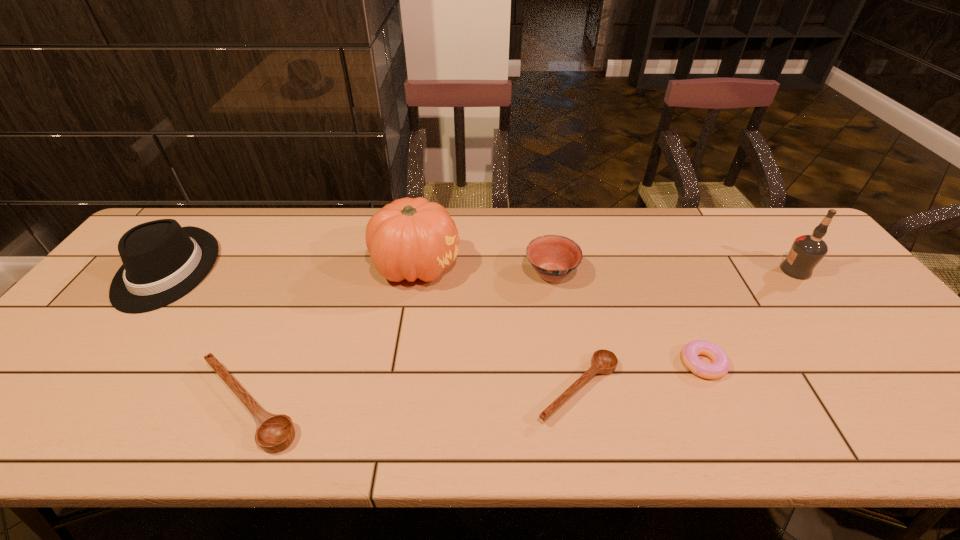
The width and height of the screenshot is (960, 540). Find the location of `vacant space located 0.090m on the back of the right wooden spoon`. vacant space located 0.090m on the back of the right wooden spoon is located at coordinates (566, 327).

Find the location of a particular element. free space located on the front label of the vodka is located at coordinates (722, 270).

Where is `vacant space located on the front label of the vodka`? This screenshot has width=960, height=540. vacant space located on the front label of the vodka is located at coordinates (674, 270).

Locate an element on the screen. The height and width of the screenshot is (540, 960). free space located 0.270m on the front label of the vodka is located at coordinates (687, 270).

The height and width of the screenshot is (540, 960). I want to click on blank space located 0.130m on the front-facing side of the fedora, so click(103, 355).

The width and height of the screenshot is (960, 540). What are the coordinates of `free space located on the back of the bowl` in the screenshot? It's located at (546, 246).

I want to click on vacant space located 0.120m on the carved face of the pumpkin, so click(502, 266).

You are a GUI agent. You are given a task and a screenshot of the screen. Output one action in this format:
    pyautogui.click(x=<x>, y=<y>)
    Task: Click on the free space located on the left of the second object from right to left
    
    Given the screenshot: What is the action you would take?
    pyautogui.click(x=562, y=363)

Locate an element on the screen. This screenshot has width=960, height=540. fedora that is positioned at the far edge is located at coordinates (162, 262).

The image size is (960, 540). What are the coordinates of `pumpkin present at the far edge` in the screenshot? It's located at (410, 238).